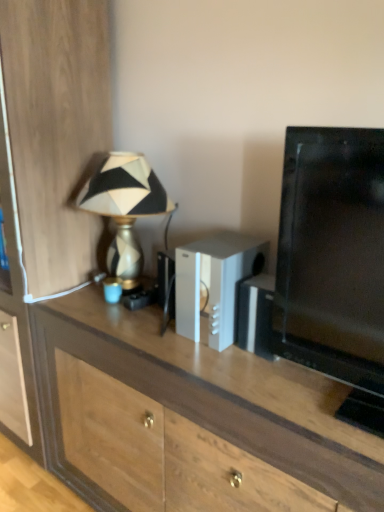
At what (x,y) coordinates should I click in order to perform the action: click on vacant region to the left of silver metallic speaker at center. Please return your answer as a coordinate pair (x, y). The width and height of the screenshot is (384, 512). Looking at the image, I should click on (150, 335).